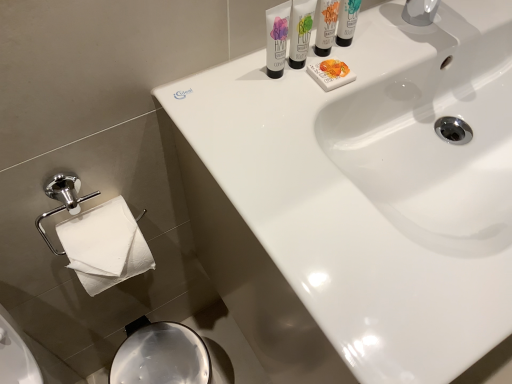
This screenshot has width=512, height=384. What are the coordinates of `vacant area that is in front of matte white shaving cream at upper center, the 2th shaving cream viewed from the left` in the screenshot? It's located at (284, 152).